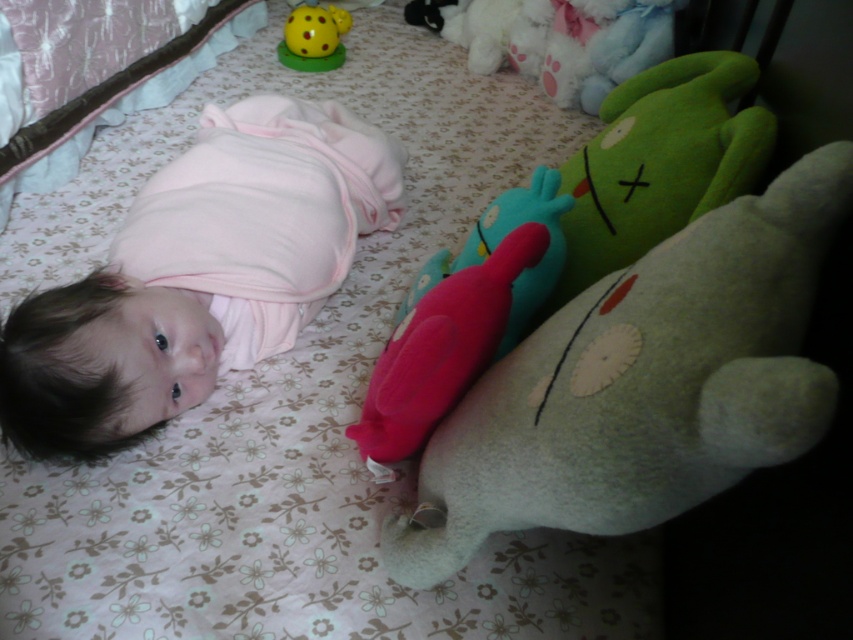
You are a parent trying to place a small toy between the fluffy green bear at center and the rubber duck at center. The toy is 6 inches long. Will it fit in the space between them?

The space between the fluffy green bear at center and the rubber duck at center is 6.64 inches. Since the toy is 6 inches long, it will fit with a small amount of space remaining.

You are a parent trying to choose a toy for your baby. You have two options in the image, the pink soft fabric baby at upper left and the rubber duck at center. Which one is larger?

The pink soft fabric baby at upper left is bigger than the rubber duck at center, so the pink soft fabric baby at upper left is the larger option.

You are a parent looking at the baby and the toys. Which toy is positioned to the right of the other between the rubber duck at center and the yellow rubber ball at upper center?

The rubber duck at center is positioned to the right of the yellow rubber ball at upper center.